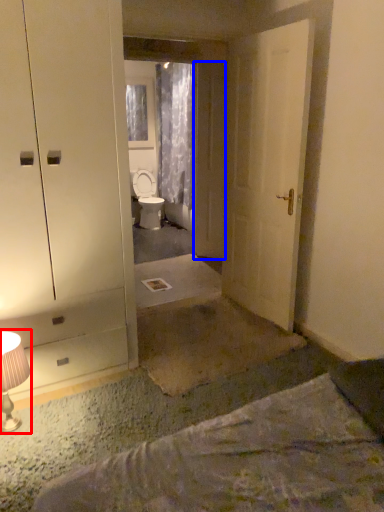
Question: Which point is further to the camera, table lamp (highlighted by a red box) or door (highlighted by a blue box)?

Choices:
 (A) table lamp
 (B) door

Answer: (B)